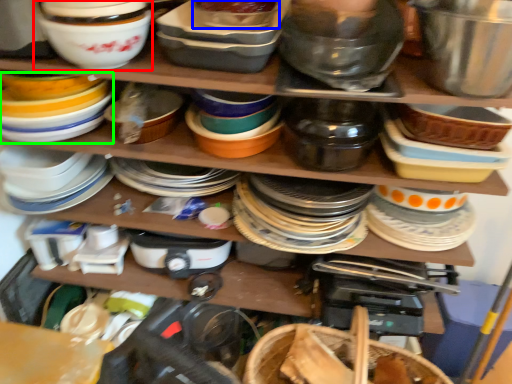
Question: Estimate the real-world distances between objects in this image. Which object is closer to bowl (highlighted by a red box), bowl (highlighted by a blue box) or appliance (highlighted by a green box)?

Choices:
 (A) bowl
 (B) appliance

Answer: (B)